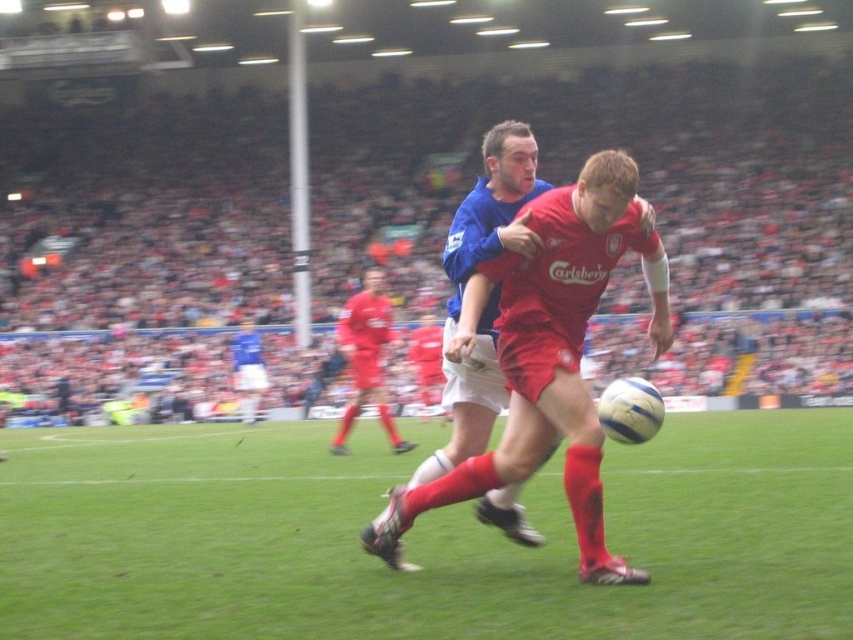
Which is behind, point (827, 472) or point (363, 531)?

The point (827, 472) is more distant.

Which of these two, green grass at center or blue jersey at center, stands taller?

blue jersey at center is taller.

What do you see at coordinates (421, 538) in the screenshot? This screenshot has width=853, height=640. I see `green grass at center` at bounding box center [421, 538].

Where is `green grass at center`? Image resolution: width=853 pixels, height=640 pixels. green grass at center is located at coordinates (421, 538).

Can you confirm if green grass at center is positioned below matte red soccer player at center?

Correct, green grass at center is located below matte red soccer player at center.

Is green grass at center above matte red soccer player at center?

Incorrect, green grass at center is not positioned above matte red soccer player at center.

At what (x,y) coordinates should I click in order to perform the action: click on green grass at center. Please return your answer as a coordinate pair (x, y). The image size is (853, 640). Looking at the image, I should click on (421, 538).

Locate an element on the screen. The image size is (853, 640). green grass at center is located at coordinates (421, 538).

Based on the photo, who is taller, blue jersey at center or matte red soccer player at center?

blue jersey at center

Is blue jersey at center further to camera compared to matte red soccer player at center?

No, blue jersey at center is closer to the viewer.

Where is `blue jersey at center`? blue jersey at center is located at coordinates (492, 211).